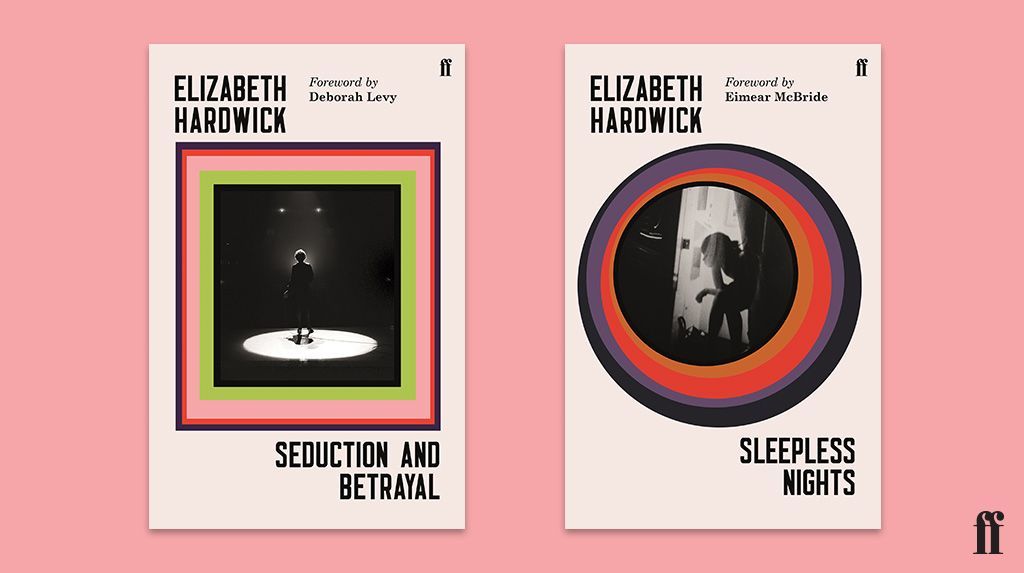
Where is `spotlights`? spotlights is located at coordinates (281, 210), (317, 210).